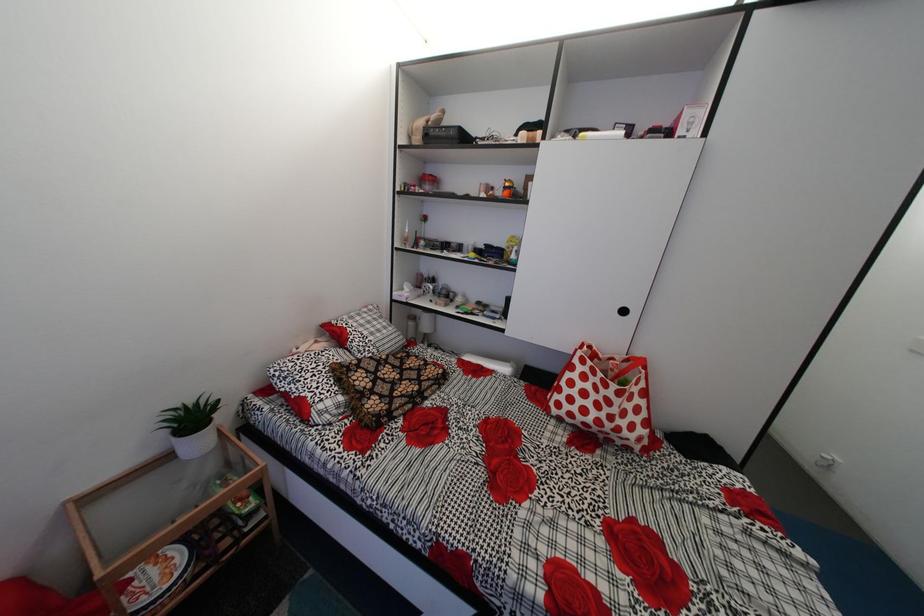
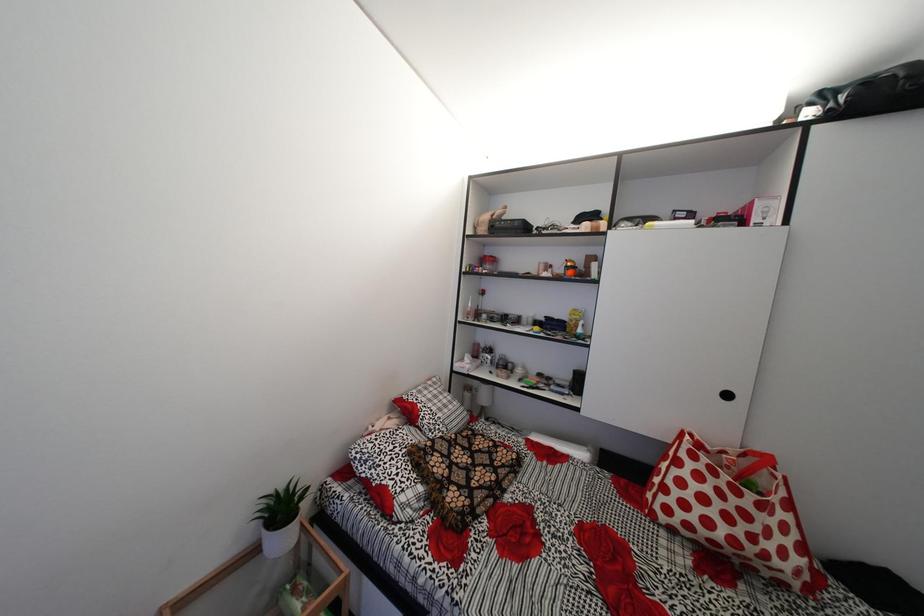
Question: The images are taken continuously from a first-person perspective. In which direction are you moving?

Choices:
 (A) Left
 (B) Right
 (C) Forward
 (D) Backward

Answer: (A)